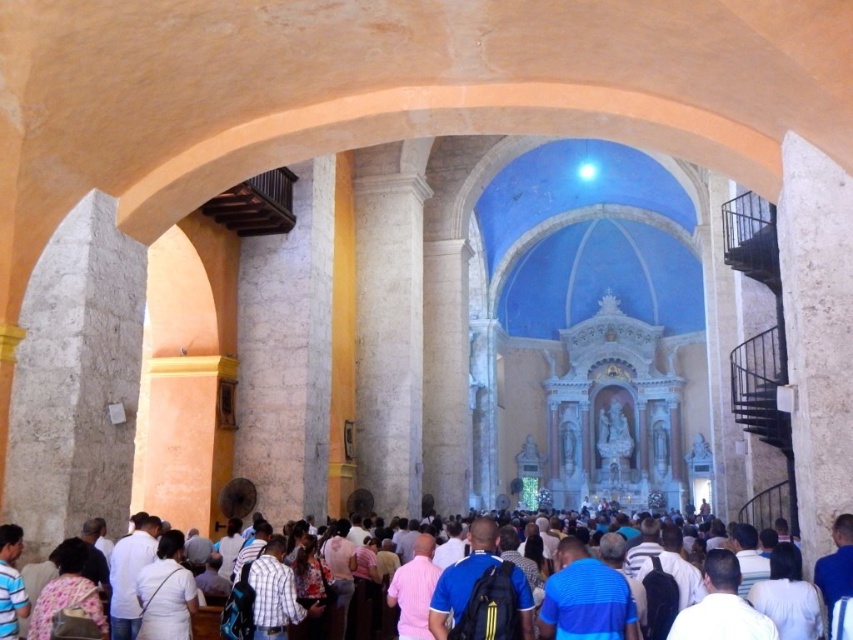
Question: Can you confirm if white fabric shirt at lower left is positioned above light brown leather backpack at lower left?

Choices:
 (A) yes
 (B) no

Answer: (B)

Question: Does white cotton shirt at center appear on the left side of light brown leather backpack at lower left?

Choices:
 (A) yes
 (B) no

Answer: (B)

Question: Which point is farther to the camera?

Choices:
 (A) (163, 545)
 (B) (78, 552)

Answer: (A)

Question: Can you confirm if white cotton shirt at center is smaller than light brown leather backpack at lower left?

Choices:
 (A) no
 (B) yes

Answer: (A)

Question: Which point is closer to the camera?

Choices:
 (A) light brown leather backpack at lower left
 (B) white fabric shirt at lower left
 (C) white cotton shirt at center

Answer: (C)

Question: Which object is the closest to the light brown leather backpack at lower left?

Choices:
 (A) white fabric shirt at lower left
 (B) white cotton shirt at center

Answer: (A)